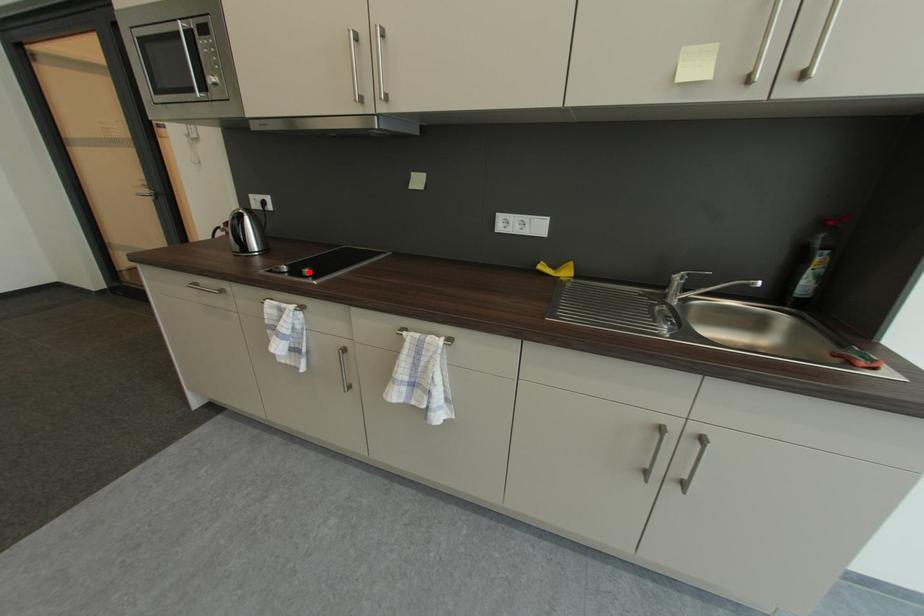
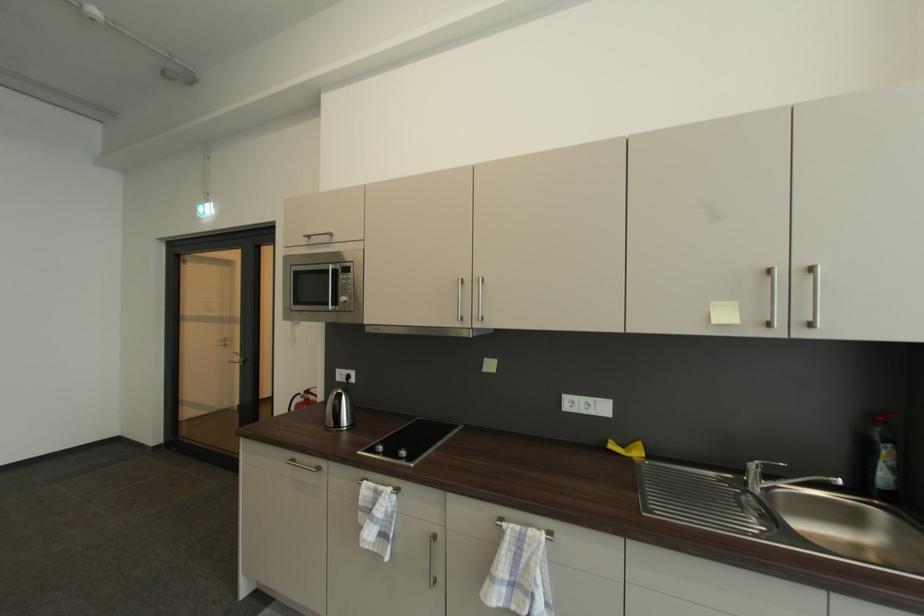
The point at the highlighted location is marked in the first image. Where is the corresponding point in the second image?

(406, 454)